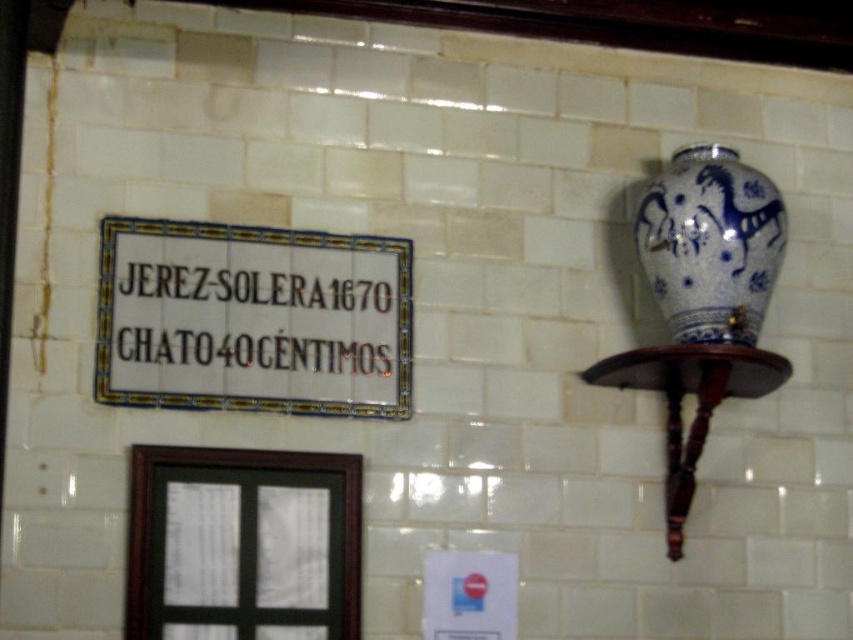
Question: Which of the following is the closest to the observer?

Choices:
 (A) (292, 400)
 (B) (714, 186)

Answer: (B)

Question: Is white ceramic sign at upper left bigger than blue and white ceramic vase at upper right?

Choices:
 (A) yes
 (B) no

Answer: (A)

Question: Does white ceramic sign at upper left appear on the left side of blue and white ceramic vase at upper right?

Choices:
 (A) no
 (B) yes

Answer: (B)

Question: Does white ceramic sign at upper left have a greater width compared to blue and white ceramic vase at upper right?

Choices:
 (A) yes
 (B) no

Answer: (A)

Question: Which object appears closest to the camera in this image?

Choices:
 (A) white ceramic sign at upper left
 (B) blue and white ceramic vase at upper right

Answer: (A)